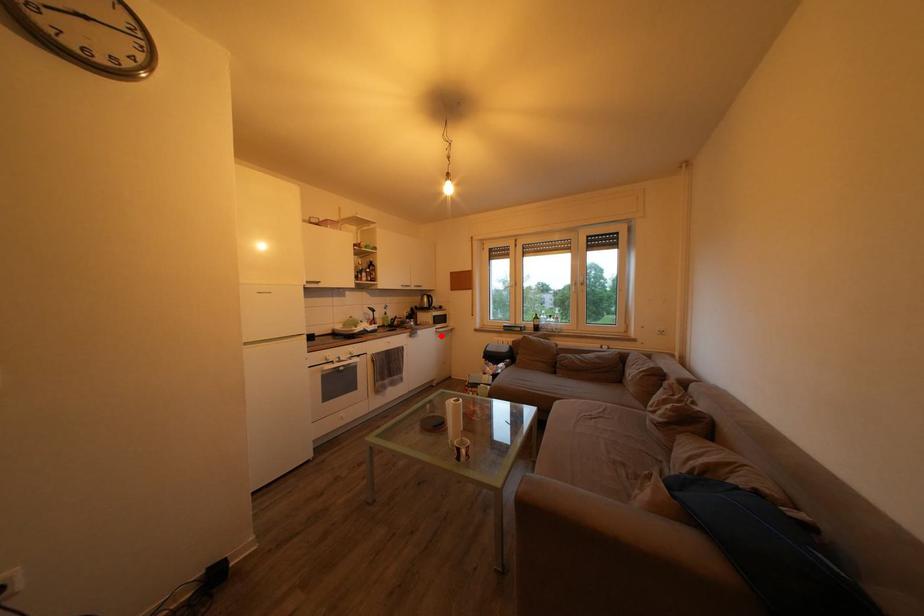
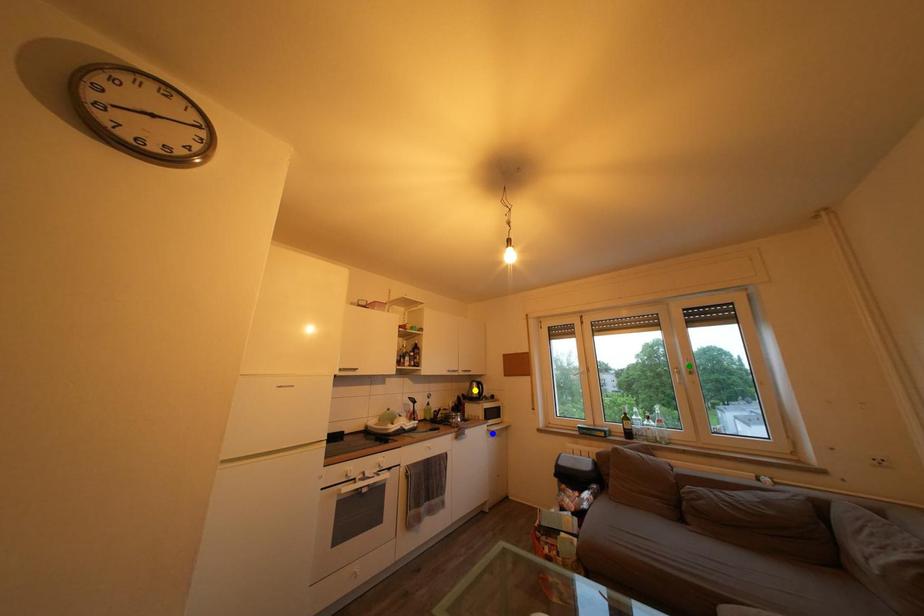
Question: I am providing you with two images of the same scene from different viewpoints. A red point is marked on the first image. You are given multiple points on the second image. Which point in image 2 represents the same 3d spot as the red point in image 1?

Choices:
 (A) blue point
 (B) yellow point
 (C) green point

Answer: (A)